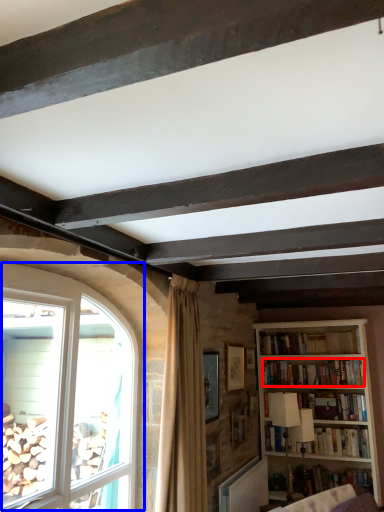
Question: Which of the following is the farthest to the observer, book (highlighted by a red box) or window (highlighted by a blue box)?

Choices:
 (A) book
 (B) window

Answer: (A)